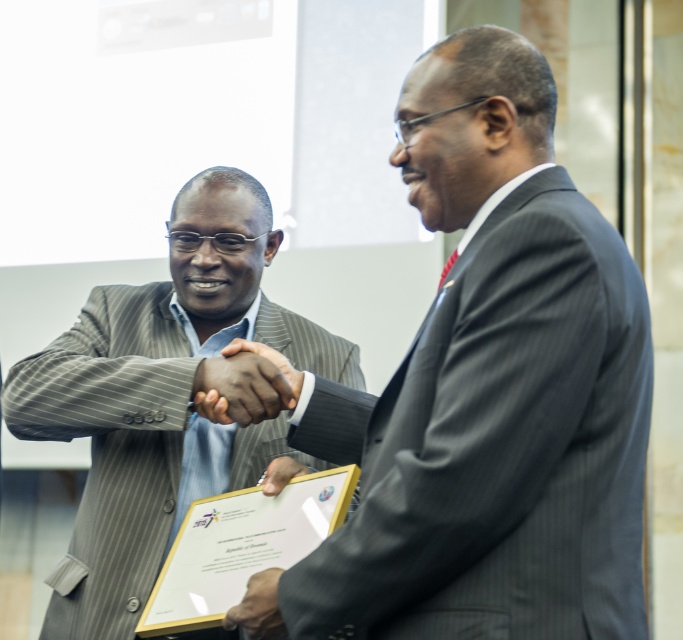
You are a photographer at the event and want to capture a closeup of both hands holding the certificate. The camera you are using has a macro lens that can focus on objects within a 1.5 inch range. Can you fit both the black leather hand at center and the black matte hand at center in the frame without moving the camera?

The black leather hand at center and black matte hand at center are 1.31 inches apart from each other. Since the distance between them is within the 1.5 inch range of the macro lens, you can fit both hands in the frame without moving the camera.

What are the coordinates of the black matte hand at center?

The black matte hand at center is located at coordinates point (270, 362).